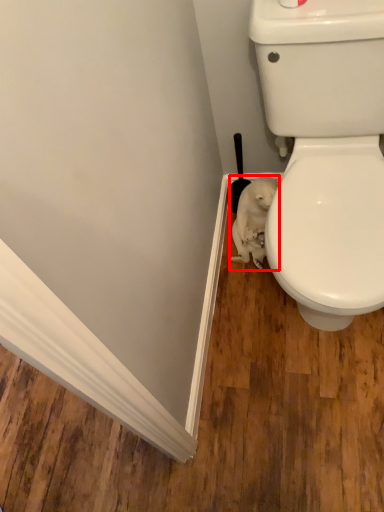
Question: Where is animal (annotated by the red box) located in relation to brush in the image?

Choices:
 (A) left
 (B) right

Answer: (B)